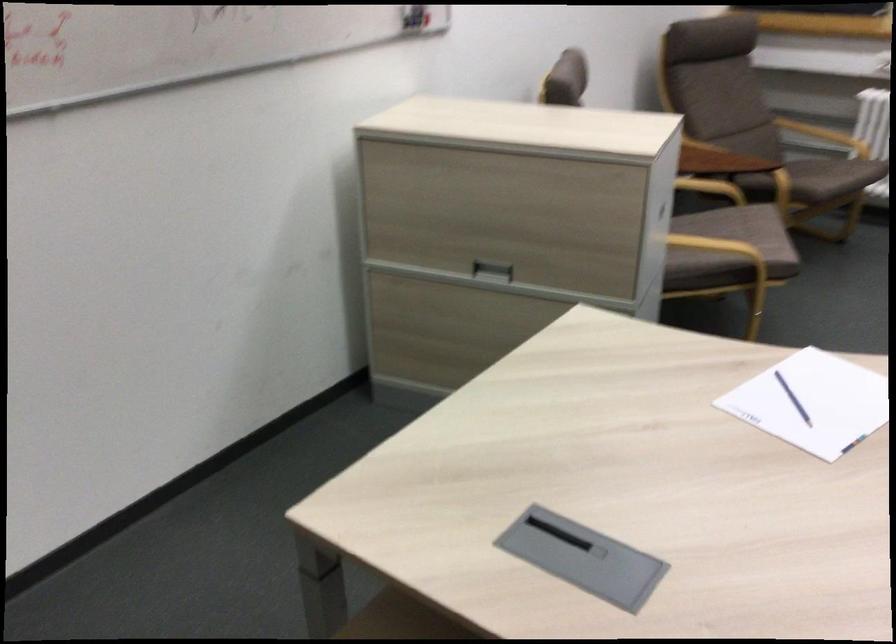
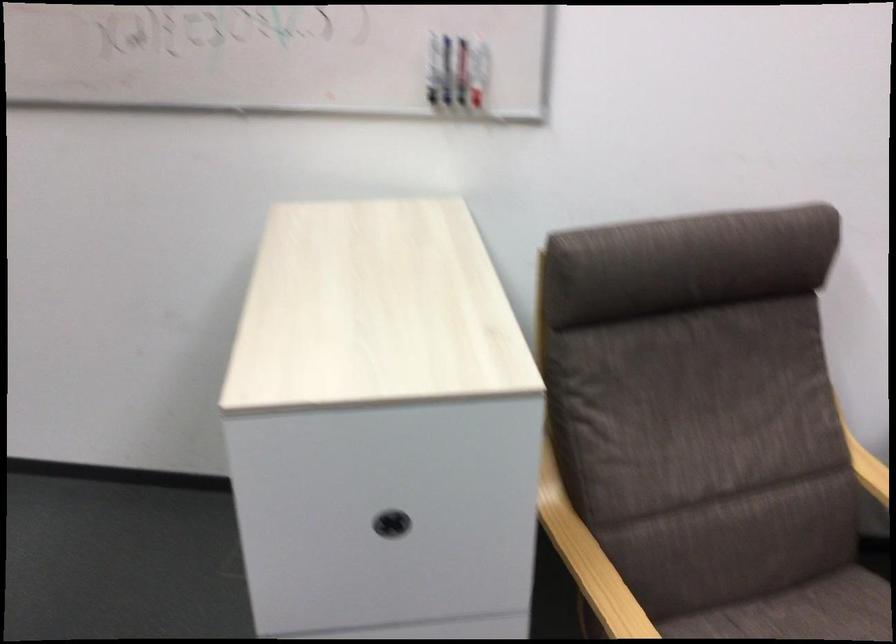
Where in the second image is the point corresponding to point (659, 210) from the first image?

(391, 524)